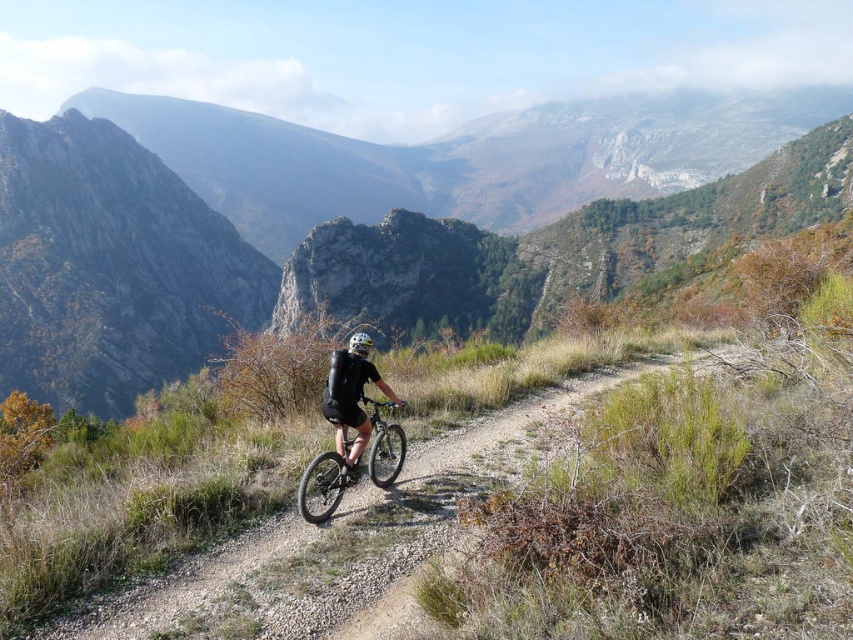
You are a mountain biker planning your route. You see the shiny metallic bicycle at center on the path. Is the bicycle positioned closer to the left or right side of the path?

The shiny metallic bicycle at center is positioned at point (323, 484), so it is closer to the right side of the path.

You are a mountain biker navigating a narrow dirt path. You see the rugged stone mountain at center. Can you estimate its location relative to your current position?

The rugged stone mountain at center is located at coordinates point (291, 209) relative to your current position.